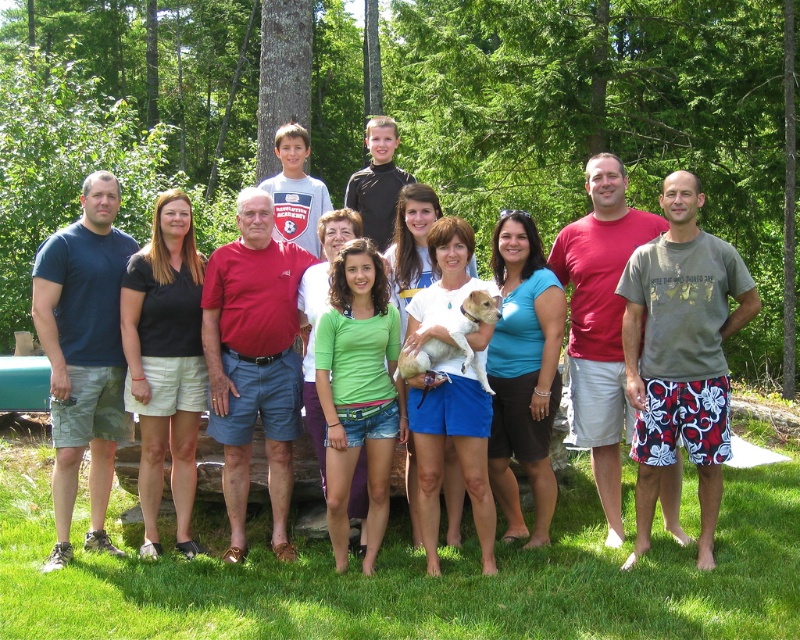
Question: Estimate the real-world distances between objects in this image. Which object is closer to the matte blue shirt at center?

Choices:
 (A) green leafy tree at center
 (B) white fur dog at center

Answer: (B)

Question: Can you confirm if green leafy tree at center is positioned to the left of white fur dog at center?

Choices:
 (A) yes
 (B) no

Answer: (A)

Question: Can you confirm if green leafy tree at center is wider than white fur dog at center?

Choices:
 (A) no
 (B) yes

Answer: (B)

Question: Is matte blue shirt at center further to the viewer compared to white fur dog at center?

Choices:
 (A) no
 (B) yes

Answer: (B)

Question: Which point is farther from the camera taking this photo?

Choices:
 (A) (400, 440)
 (B) (476, 374)

Answer: (A)

Question: Which point is farther to the camera?

Choices:
 (A) (240, 17)
 (B) (417, 369)

Answer: (A)